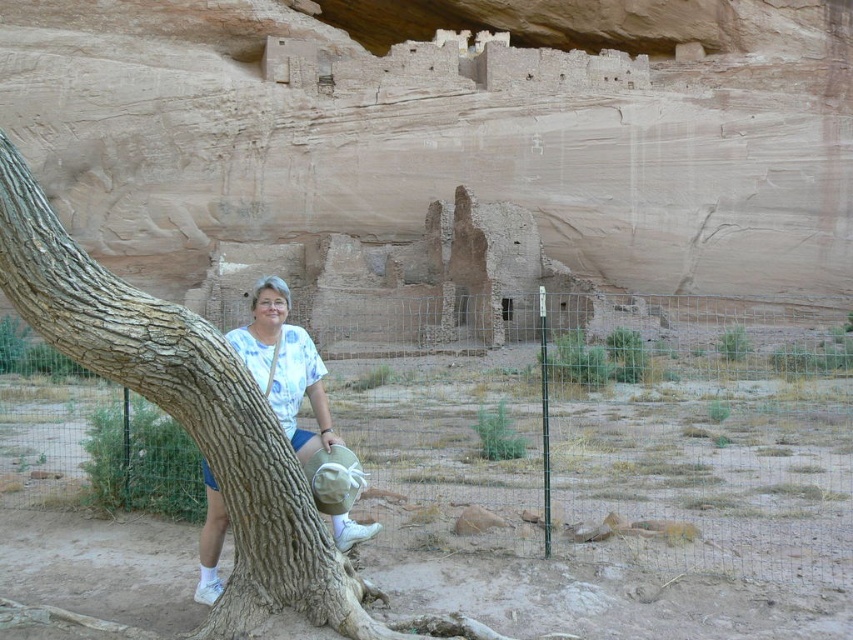
Does brown rough bark tree at center have a smaller size compared to white cotton shirt at center?

Correct, brown rough bark tree at center occupies less space than white cotton shirt at center.

Is brown rough bark tree at center below white cotton shirt at center?

Yes.

Is point (299, 531) behind point (273, 360)?

No, (299, 531) is closer to viewer.

This screenshot has width=853, height=640. Find the location of `brown rough bark tree at center`. brown rough bark tree at center is located at coordinates (194, 422).